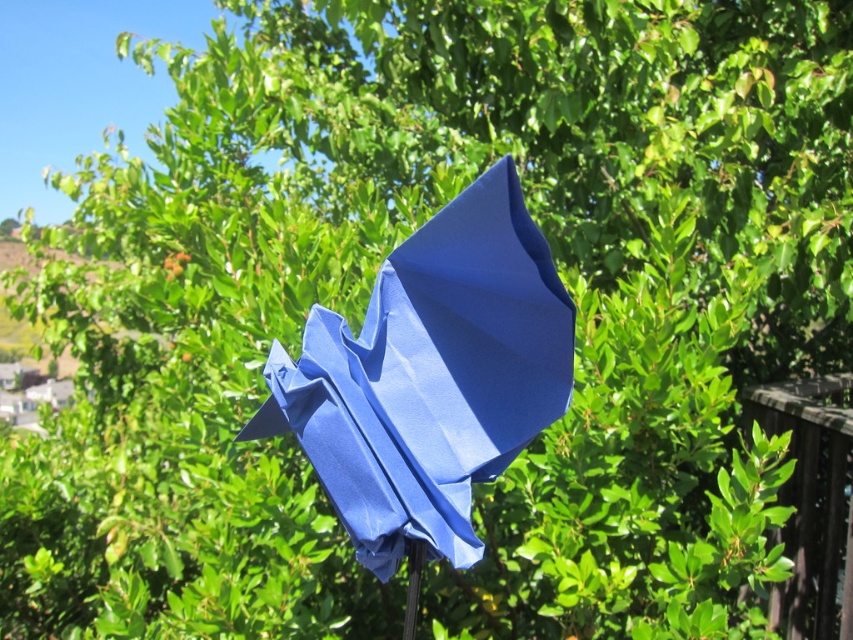
Is point (848, 397) closer to viewer compared to point (405, 614)?

No, it is behind (405, 614).

Can you confirm if brown wooden fence at right is smaller than metallic silver pole at lower center?

Incorrect, brown wooden fence at right is not smaller in size than metallic silver pole at lower center.

Where is `brown wooden fence at right`? brown wooden fence at right is located at coordinates [811, 500].

Is matte blue umbrella at center bigger than metallic silver pole at lower center?

Correct, matte blue umbrella at center is larger in size than metallic silver pole at lower center.

Is point (534, 364) positioned in front of point (416, 572)?

Yes.

Identify the location of matte blue umbrella at center. The height and width of the screenshot is (640, 853). 430,376.

What do you see at coordinates (430, 376) in the screenshot? I see `matte blue umbrella at center` at bounding box center [430, 376].

Is the position of matte blue umbrella at center less distant than that of brown wooden fence at right?

Yes, matte blue umbrella at center is in front of brown wooden fence at right.

Who is more forward, (x=515, y=436) or (x=851, y=413)?

Point (x=515, y=436) is in front.

Where is `matte blue umbrella at center`? matte blue umbrella at center is located at coordinates pyautogui.click(x=430, y=376).